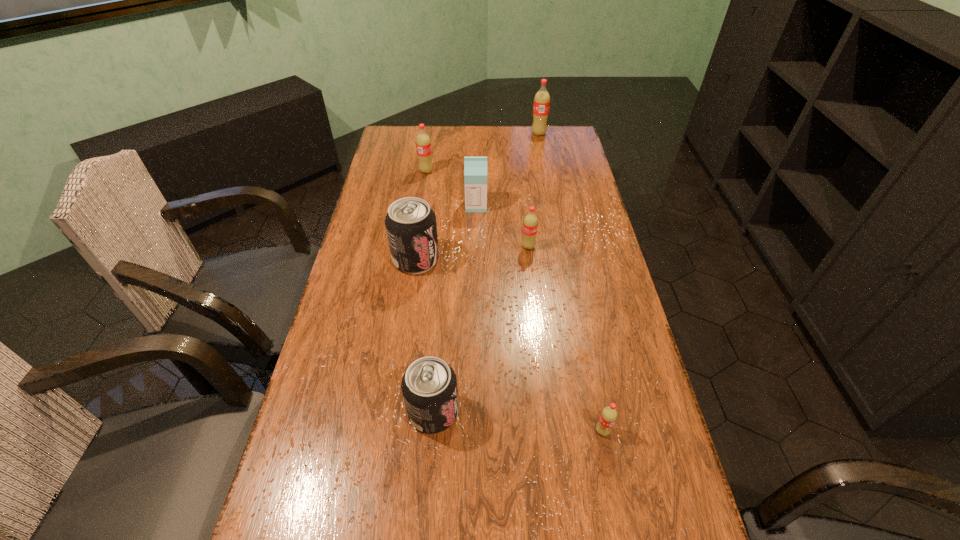
Where is `vacant space in between the second farthest object and the smallest red soda`? The width and height of the screenshot is (960, 540). vacant space in between the second farthest object and the smallest red soda is located at coordinates (515, 301).

Find the location of `vacant area that lies between the white milk carton and the farthest soda`. vacant area that lies between the white milk carton and the farthest soda is located at coordinates (508, 170).

Locate an element on the screen. object that stands as the closest to the farther black soda can is located at coordinates (475, 168).

Point out which object is positioned as the second nearest to the smaller black soda can. Please provide its 2D coordinates. Your answer should be formatted as a tuple, i.e. [(x, y)], where the tuple contains the x and y coordinates of a point satisfying the conditions above.

[(410, 223)]

Identify which soda is the fourth nearest to the smallest red soda. Please provide its 2D coordinates. Your answer should be formatted as a tuple, i.e. [(x, y)], where the tuple contains the x and y coordinates of a point satisfying the conditions above.

[(423, 143)]

Find the location of a particular element. soda that is the fourth closest one to the third nearest red soda is located at coordinates (429, 386).

Identify which red soda is the second closest to the third object from right to left. Please provide its 2D coordinates. Your answer should be formatted as a tuple, i.e. [(x, y)], where the tuple contains the x and y coordinates of a point satisfying the conditions above.

[(609, 415)]

Choose which red soda is the nearest neighbor to the smaller black soda can. Please provide its 2D coordinates. Your answer should be formatted as a tuple, i.e. [(x, y)], where the tuple contains the x and y coordinates of a point satisfying the conditions above.

[(609, 415)]

Point out which black soda can is positioned as the nearest to the shortest object. Please provide its 2D coordinates. Your answer should be formatted as a tuple, i.e. [(x, y)], where the tuple contains the x and y coordinates of a point satisfying the conditions above.

[(429, 386)]

Select which black soda can appears as the closest to the second biggest red soda. Please provide its 2D coordinates. Your answer should be formatted as a tuple, i.e. [(x, y)], where the tuple contains the x and y coordinates of a point satisfying the conditions above.

[(410, 223)]